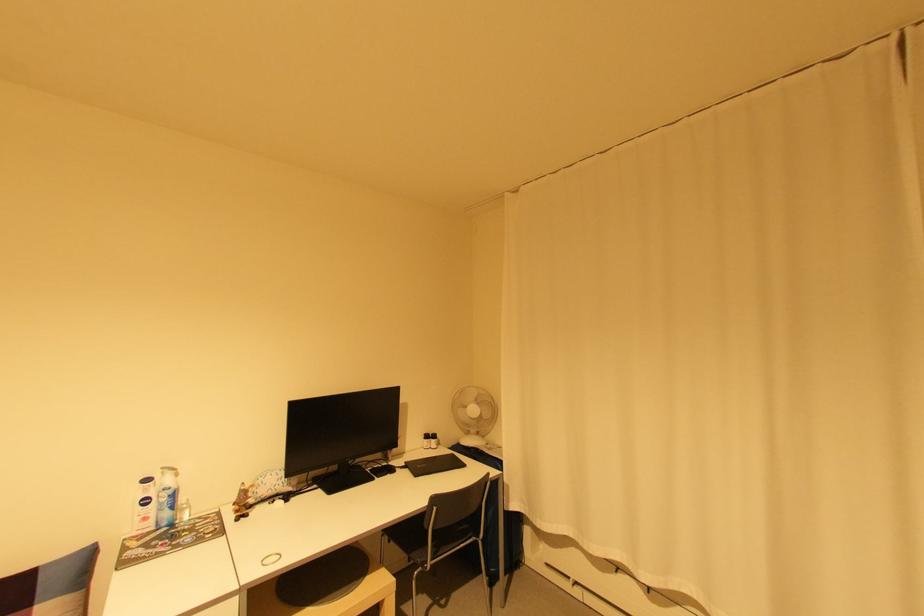
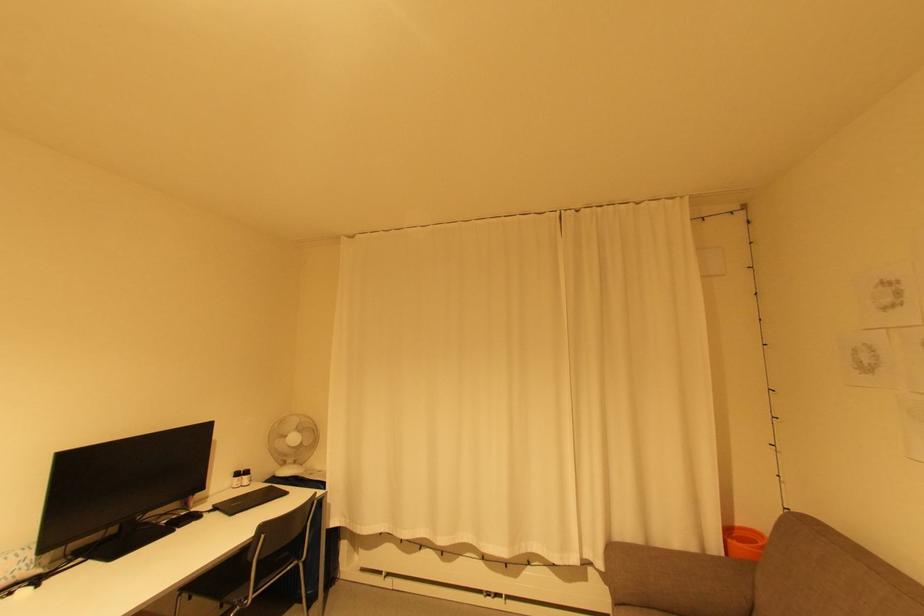
Question: The camera is either moving clockwise (left) or counter-clockwise (right) around the object. The first image is from the beginning of the video and the second image is from the end. Is the camera moving left or right when shooting the video?

Choices:
 (A) Left
 (B) Right

Answer: (A)